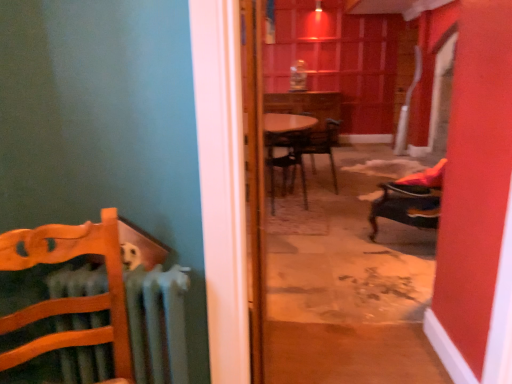
Question: Considering the relative sizes of wooden chair at left, the 1th chair viewed from the left, and metallic dark brown chair at center, the first chair viewed from the back, in the image provided, is wooden chair at left, the 1th chair viewed from the left, wider than metallic dark brown chair at center, the first chair viewed from the back,?

Choices:
 (A) no
 (B) yes

Answer: (A)

Question: Is wooden chair at left, the 4th chair when ordered from right to left, not inside metallic dark brown chair at center, the first chair viewed from the back?

Choices:
 (A) yes
 (B) no

Answer: (A)

Question: From the image's perspective, is wooden chair at left, the 1th chair viewed from the left, under metallic dark brown chair at center, marked as the third chair in a left-to-right arrangement?

Choices:
 (A) yes
 (B) no

Answer: (A)

Question: Is wooden chair at left, the first chair viewed from the front, behind metallic dark brown chair at center, the first chair viewed from the back?

Choices:
 (A) no
 (B) yes

Answer: (A)

Question: Is wooden chair at left, the first chair viewed from the front, oriented away from metallic dark brown chair at center, which is counted as the second chair, starting from the right?

Choices:
 (A) yes
 (B) no

Answer: (B)

Question: Does wooden chair at left, the first chair viewed from the front, have a lesser width compared to metallic dark brown chair at center, which is counted as the second chair, starting from the right?

Choices:
 (A) no
 (B) yes

Answer: (B)

Question: From a real-world perspective, is metallic dark brown chair at center, which is counted as the second chair, starting from the right, below wooden door at center?

Choices:
 (A) yes
 (B) no

Answer: (A)

Question: Is metallic dark brown chair at center, which is counted as the second chair, starting from the right, positioned behind wooden door at center?

Choices:
 (A) no
 (B) yes

Answer: (B)

Question: Is metallic dark brown chair at center, marked as the third chair in a left-to-right arrangement, outside of wooden door at center?

Choices:
 (A) yes
 (B) no

Answer: (A)

Question: Is metallic dark brown chair at center, which is counted as the second chair, starting from the right, positioned before wooden door at center?

Choices:
 (A) no
 (B) yes

Answer: (A)

Question: Considering the relative positions of metallic dark brown chair at center, which is counted as the second chair, starting from the right, and wooden door at center in the image provided, is metallic dark brown chair at center, which is counted as the second chair, starting from the right, to the right of wooden door at center from the viewer's perspective?

Choices:
 (A) yes
 (B) no

Answer: (A)

Question: Considering the relative sizes of metallic dark brown chair at center, marked as the third chair in a left-to-right arrangement, and wooden door at center in the image provided, is metallic dark brown chair at center, marked as the third chair in a left-to-right arrangement, taller than wooden door at center?

Choices:
 (A) no
 (B) yes

Answer: (A)

Question: Does wooden chair at left, the 4th chair when ordered from right to left, touch wooden door at center?

Choices:
 (A) no
 (B) yes

Answer: (A)